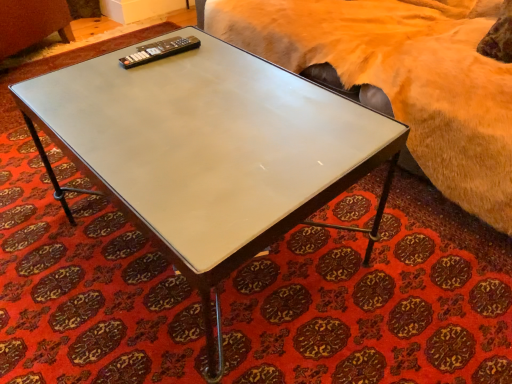
Describe the element at coordinates (159, 51) in the screenshot. The height and width of the screenshot is (384, 512). I see `black plastic remote at upper left` at that location.

The image size is (512, 384). Find the location of `fuzzy beige bed at upper right`. fuzzy beige bed at upper right is located at coordinates (402, 79).

This screenshot has width=512, height=384. What do you see at coordinates (208, 153) in the screenshot?
I see `white glossy coffee table at center` at bounding box center [208, 153].

Measure the distance between point (203, 115) and camera.

Point (203, 115) is 95.70 centimeters away from camera.

The height and width of the screenshot is (384, 512). Identify the location of black plastic remote at upper left. (159, 51).

Based on the photo, from a real-world perspective, is fuzzy beige bed at upper right positioned over black plastic remote at upper left based on gravity?

Incorrect, from a real-world perspective, fuzzy beige bed at upper right is lower than black plastic remote at upper left.

From the picture: Is black plastic remote at upper left surrounded by fuzzy beige bed at upper right?

Definitely not — black plastic remote at upper left is not inside fuzzy beige bed at upper right.

Is point (265, 8) positioned behind point (196, 43)?

Yes, it is behind point (196, 43).

Is fuzzy beige bed at upper right thinner than black plastic remote at upper left?

Incorrect, the width of fuzzy beige bed at upper right is not less than that of black plastic remote at upper left.

From the image's perspective, is white glossy coffee table at center on black plastic remote at upper left?

Actually, white glossy coffee table at center appears below black plastic remote at upper left in the image.

Does white glossy coffee table at center have a lesser height compared to black plastic remote at upper left?

In fact, white glossy coffee table at center may be taller than black plastic remote at upper left.

Which is farther, (346, 170) or (134, 63)?

Positioned behind is point (134, 63).

How many degrees apart are the facing directions of white glossy coffee table at center and black plastic remote at upper left?

white glossy coffee table at center and black plastic remote at upper left are facing 7.57 degrees away from each other.

Between point (423, 127) and point (249, 101), which one is positioned in front?

The point (249, 101) is in front.

From a real-world perspective, is fuzzy beige bed at upper right under white glossy coffee table at center?

No, from a real-world perspective, fuzzy beige bed at upper right is not below white glossy coffee table at center.

Can you confirm if fuzzy beige bed at upper right is positioned to the left of white glossy coffee table at center?

In fact, fuzzy beige bed at upper right is to the right of white glossy coffee table at center.

Can you confirm if fuzzy beige bed at upper right is bigger than white glossy coffee table at center?

Correct, fuzzy beige bed at upper right is larger in size than white glossy coffee table at center.

Locate an element on the screen. bed located in front of the black plastic remote at upper left is located at coordinates tap(402, 79).

Is point (198, 42) positioned before point (244, 26)?

Yes, point (198, 42) is in front of point (244, 26).

Can you confirm if black plastic remote at upper left is positioned to the left of fuzzy beige bed at upper right?

Indeed, black plastic remote at upper left is positioned on the left side of fuzzy beige bed at upper right.

From the image's perspective, is black plastic remote at upper left under fuzzy beige bed at upper right?

Correct, black plastic remote at upper left appears lower than fuzzy beige bed at upper right in the image.

Is black plastic remote at upper left not near white glossy coffee table at center?

black plastic remote at upper left is actually quite close to white glossy coffee table at center.

I want to click on coffee table below the black plastic remote at upper left (from a real-world perspective), so click(208, 153).

Can you confirm if black plastic remote at upper left is wider than white glossy coffee table at center?

No, black plastic remote at upper left is not wider than white glossy coffee table at center.

In the scene shown: Is black plastic remote at upper left looking in the opposite direction of white glossy coffee table at center?

black plastic remote at upper left is not turned away from white glossy coffee table at center.

From the image's perspective, between white glossy coffee table at center and fuzzy beige bed at upper right, who is located below?

From the image's view, white glossy coffee table at center is below.

Which object is positioned more to the right, white glossy coffee table at center or fuzzy beige bed at upper right?

fuzzy beige bed at upper right.

Is point (236, 152) farther from viewer compared to point (499, 161)?

No, (236, 152) is closer to viewer.

Is white glossy coffee table at center bigger than fuzzy beige bed at upper right?

No, white glossy coffee table at center is not bigger than fuzzy beige bed at upper right.

You are a GUI agent. You are given a task and a screenshot of the screen. Output one action in this format:
    pyautogui.click(x=<x>, y=<y>)
    Task: Click on the remote on the left of the fuzzy beige bed at upper right
    This screenshot has height=384, width=512.
    Given the screenshot: What is the action you would take?
    pyautogui.click(x=159, y=51)

The height and width of the screenshot is (384, 512). I want to click on coffee table below the black plastic remote at upper left (from a real-world perspective), so click(x=208, y=153).

Estimate the real-world distances between objects in this image. Which object is further from fuzzy beige bed at upper right, black plastic remote at upper left or white glossy coffee table at center?

Based on the image, black plastic remote at upper left appears to be further to fuzzy beige bed at upper right.

When comparing their distances from white glossy coffee table at center, does black plastic remote at upper left or fuzzy beige bed at upper right seem closer?

black plastic remote at upper left is positioned closer to the anchor white glossy coffee table at center.

Estimate the real-world distances between objects in this image. Which object is closer to fuzzy beige bed at upper right, white glossy coffee table at center or black plastic remote at upper left?

white glossy coffee table at center lies closer to fuzzy beige bed at upper right than the other object.

Based on their spatial positions, is fuzzy beige bed at upper right or black plastic remote at upper left further from white glossy coffee table at center?

fuzzy beige bed at upper right is positioned further to the anchor white glossy coffee table at center.

Considering their positions, is white glossy coffee table at center positioned closer to black plastic remote at upper left than fuzzy beige bed at upper right?

white glossy coffee table at center is closer to black plastic remote at upper left.

When comparing their distances from black plastic remote at upper left, does fuzzy beige bed at upper right or white glossy coffee table at center seem further?

The object further to black plastic remote at upper left is fuzzy beige bed at upper right.

This screenshot has width=512, height=384. Find the location of `coffee table between black plastic remote at upper left and fuzzy beige bed at upper right in the horizontal direction`. coffee table between black plastic remote at upper left and fuzzy beige bed at upper right in the horizontal direction is located at coordinates pos(208,153).